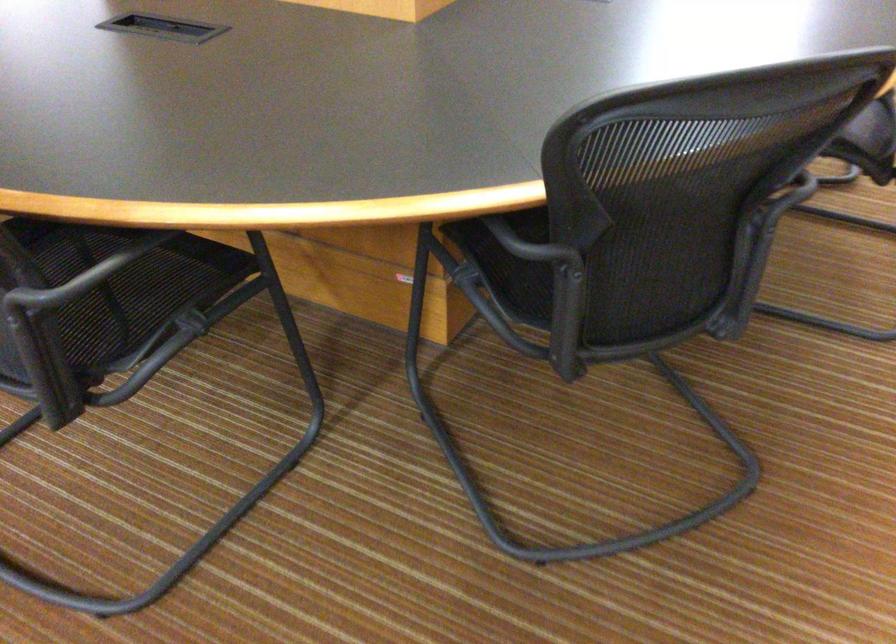
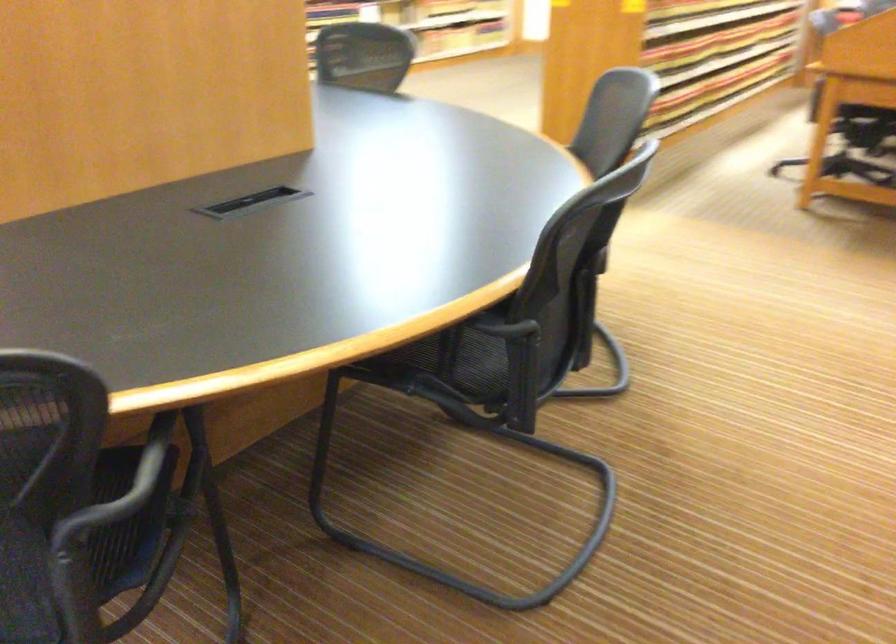
Question: What movement of the cameraman would produce the second image?

Choices:
 (A) Left
 (B) Right
 (C) Forward
 (D) Backward

Answer: (B)